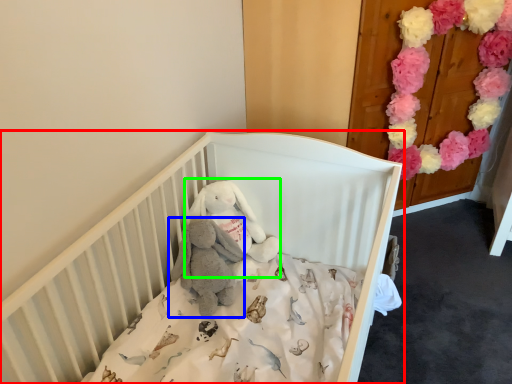
Question: Based on their relative distances, which object is farther from infant bed (highlighted by a red box)? Choose from baby elephant (highlighted by a blue box) and toy (highlighted by a green box).

Choices:
 (A) baby elephant
 (B) toy

Answer: (A)